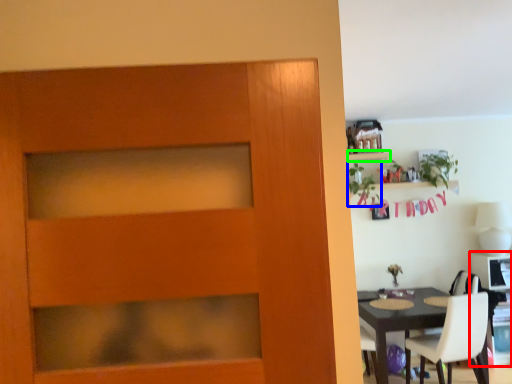
Question: Estimate the real-world distances between objects in this image. Which object is farther from computer desk (highlighted by a red box), plant (highlighted by a blue box) or shelf (highlighted by a green box)?

Choices:
 (A) plant
 (B) shelf

Answer: (B)